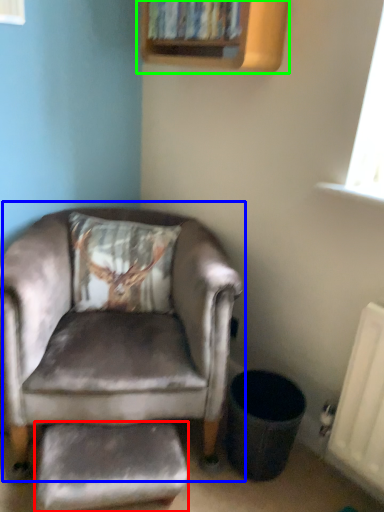
Question: Which is farther away from footrest (highlighted by a red box)? chair (highlighted by a blue box) or bookshelf (highlighted by a green box)?

Choices:
 (A) chair
 (B) bookshelf

Answer: (B)